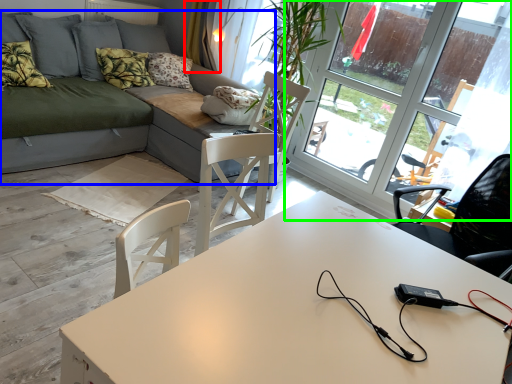
Question: Estimate the real-world distances between objects in this image. Which object is closer to curtain (highlighted by a red box), studio couch (highlighted by a blue box) or window (highlighted by a green box)?

Choices:
 (A) studio couch
 (B) window

Answer: (A)